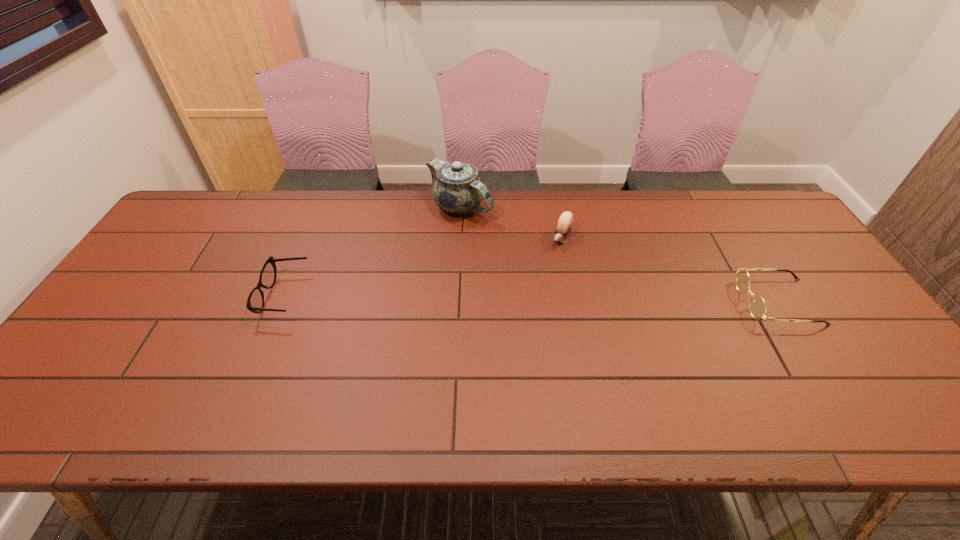
Find the location of `the left spectacles`. the left spectacles is located at coordinates (255, 303).

Where is `the right spectacles`? the right spectacles is located at coordinates (757, 306).

This screenshot has width=960, height=540. Identify the location of the second farthest object. (565, 222).

Identify the location of escargot. (565, 222).

The width and height of the screenshot is (960, 540). What are the coordinates of `the second object from left to right` in the screenshot? It's located at (457, 189).

Locate an element on the screen. The width and height of the screenshot is (960, 540). chinaware is located at coordinates (457, 189).

Locate an element on the screen. This screenshot has height=540, width=960. blank space located 0.140m on the front-facing side of the leftmost object is located at coordinates (211, 296).

Where is `free region located on the front-facing side of the leftmost object`? This screenshot has width=960, height=540. free region located on the front-facing side of the leftmost object is located at coordinates (118, 296).

The height and width of the screenshot is (540, 960). I want to click on free space located on the front-facing side of the leftmost object, so click(132, 296).

This screenshot has height=540, width=960. In order to click on vacant space situated on the lenses of the rightmost object in this screenshot , I will do `click(716, 302)`.